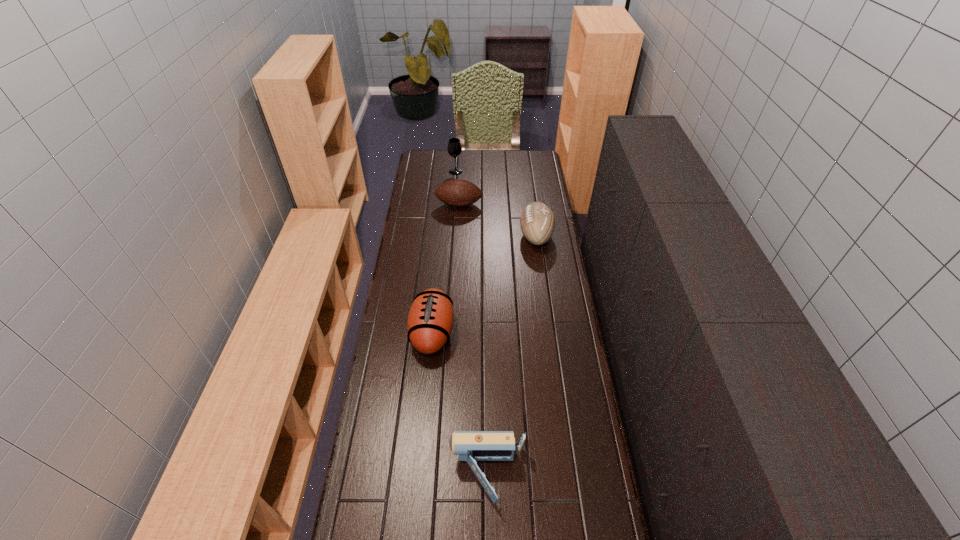
Image resolution: width=960 pixels, height=540 pixels. Find the location of `blank space that satisfies the following two spatial constraints: 1. on the laces of the rightmost object; 2. on the front side of the fourth farthest object`. blank space that satisfies the following two spatial constraints: 1. on the laces of the rightmost object; 2. on the front side of the fourth farthest object is located at coordinates (549, 333).